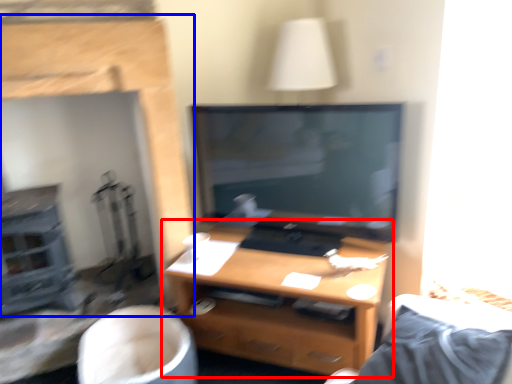
Question: Which point is further to the camera, desk (highlighted by a red box) or fireplace (highlighted by a blue box)?

Choices:
 (A) desk
 (B) fireplace

Answer: (A)